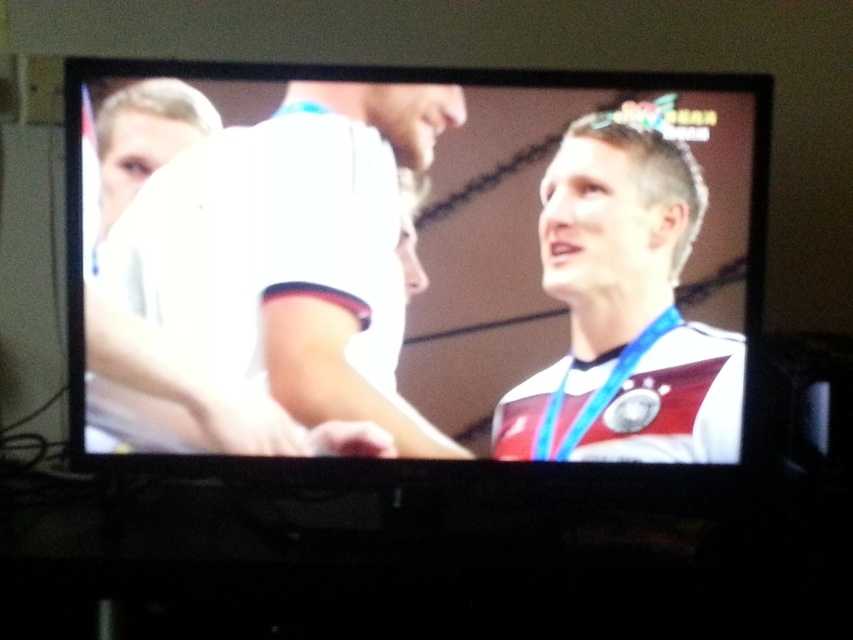
Can you confirm if white jersey at center is thinner than white fabric shirt at upper left?

No.

Does white jersey at center have a greater width compared to white fabric shirt at upper left?

Yes, white jersey at center is wider than white fabric shirt at upper left.

The image size is (853, 640). What do you see at coordinates (413, 264) in the screenshot?
I see `white jersey at center` at bounding box center [413, 264].

The width and height of the screenshot is (853, 640). In order to click on white jersey at center in this screenshot , I will do `click(413, 264)`.

Measure the distance between white fabric shirt at upper left and camera.

white fabric shirt at upper left and camera are 4.39 feet apart.

Who is more forward, [143,296] or [509,458]?

Positioned in front is point [143,296].

Is point (265, 177) more distant than point (560, 196)?

No, (265, 177) is in front of (560, 196).

Find the location of a particular element. white fabric shirt at upper left is located at coordinates (271, 282).

Can you confirm if white jersey at center is positioned to the right of white matte shirt at upper left?

Indeed, white jersey at center is positioned on the right side of white matte shirt at upper left.

Is white jersey at center below white matte shirt at upper left?

Correct, white jersey at center is located below white matte shirt at upper left.

Locate an element on the screen. white jersey at center is located at coordinates (413, 264).